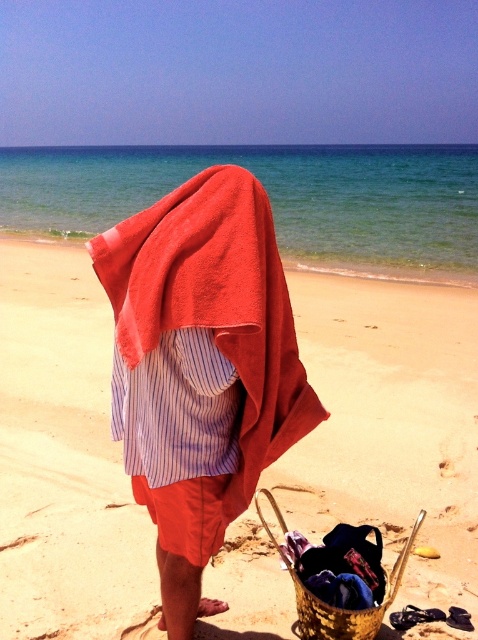
Question: Estimate the real-world distances between objects in this image. Which object is closer to the sandy beach at center?

Choices:
 (A) gold woven basket at lower center
 (B) red towel at center

Answer: (B)

Question: Is sandy beach at center below red towel at center?

Choices:
 (A) no
 (B) yes

Answer: (A)

Question: Is red towel at center bigger than gold woven basket at lower center?

Choices:
 (A) yes
 (B) no

Answer: (A)

Question: Which of the following is the farthest from the observer?

Choices:
 (A) gold woven basket at lower center
 (B) red towel at center
 (C) sandy beach at center

Answer: (C)

Question: Where is red towel at center located in relation to gold woven basket at lower center in the image?

Choices:
 (A) above
 (B) below

Answer: (A)

Question: Which object is the closest to the gold woven basket at lower center?

Choices:
 (A) red towel at center
 (B) sandy beach at center

Answer: (A)